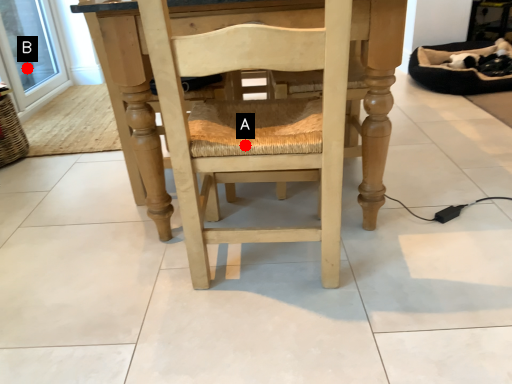
Question: Two points are circled on the image, labeled by A and B beside each circle. Which point is closer to the camera?

Choices:
 (A) A is closer
 (B) B is closer

Answer: (A)